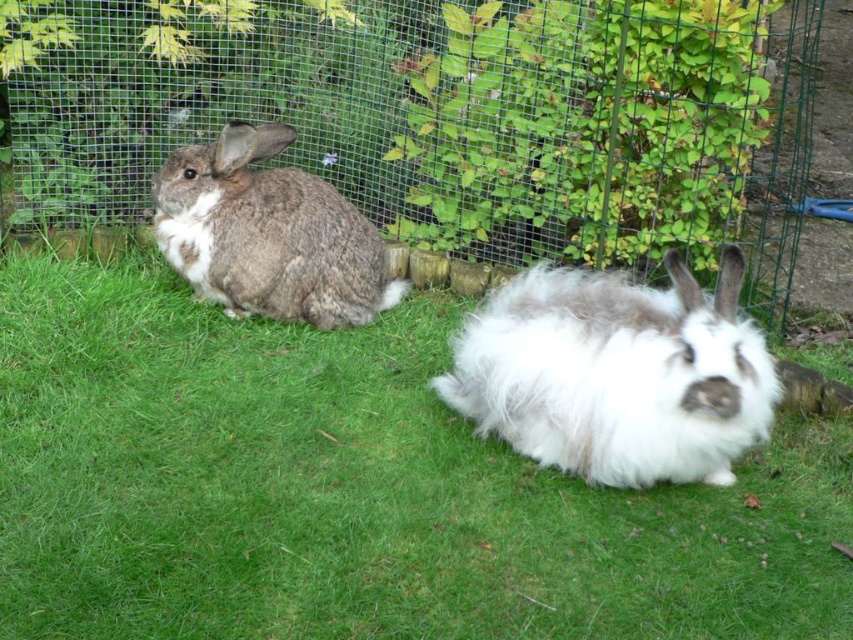
You are a photographer trying to capture both rabbits in a single shot. Given that the fluffy white rabbit at center is closer to the camera than the gray fluffy rabbit at left, which rabbit would appear larger in the photo?

The fluffy white rabbit at center would appear larger in the photo because it is closer to the camera than the gray fluffy rabbit at left.

You are standing at the point marked by coordinates point (20, 147). You want to throw a ball to hit the rabbit on the right without hitting the rabbit on the left. What should you do?

The rabbits are 3.84 meters apart. To avoid hitting the rabbit on the left, aim your throw beyond the point (20, 147) towards the rabbit on the right, ensuring the ball travels the full distance between them.